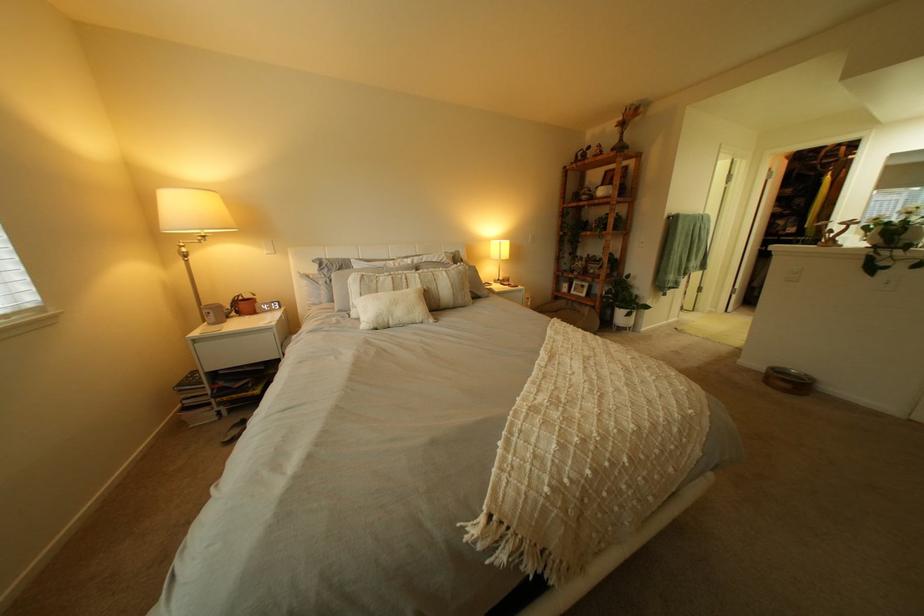
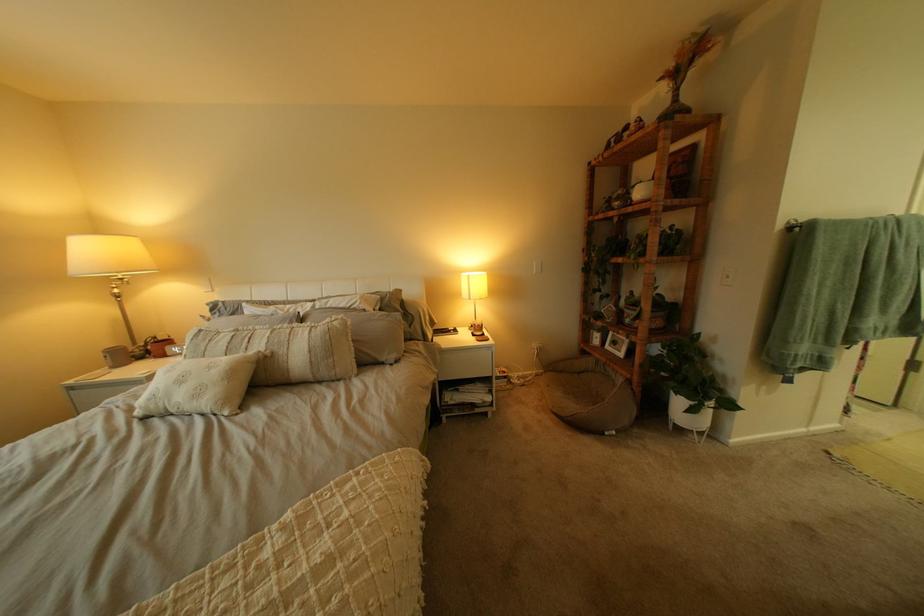
The point at (434,283) is marked in the first image. Where is the corresponding point in the second image?

(281, 342)